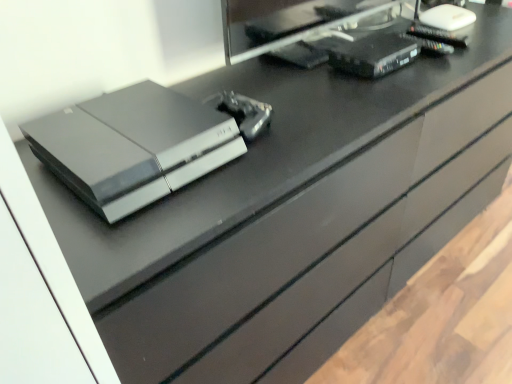
Question: Considering the positions of black plastic desktop computer at upper right and satin black console at center in the image, is black plastic desktop computer at upper right bigger or smaller than satin black console at center?

Choices:
 (A) small
 (B) big

Answer: (B)

Question: From a real-world perspective, relative to satin black console at center, is black plastic desktop computer at upper right vertically above or below?

Choices:
 (A) above
 (B) below

Answer: (A)

Question: Which object is positioned farthest from the satin black console at center?

Choices:
 (A) black plastic desktop computer at upper right
 (B) black plastic router at upper right, which is the first equipment from top to bottom
 (C) metallic silver controller at center, the second equipment from the right

Answer: (B)

Question: Estimate the real-world distances between objects in this image. Which object is farther from the black plastic desktop computer at upper right?

Choices:
 (A) metallic silver controller at center, which is the 1th equipment in bottom-to-top order
 (B) satin black console at center
 (C) black plastic router at upper right, which ranks as the second equipment in front-to-back order

Answer: (B)